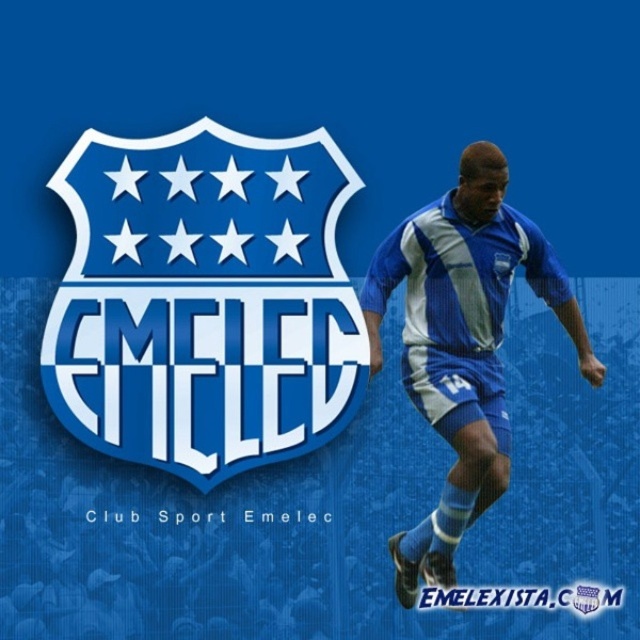
Is point (346, 193) behind point (378, 273)?

Yes, point (346, 193) is behind point (378, 273).

Does blue glossy shield at center appear on the right side of blue fabric soccer player at center?

In fact, blue glossy shield at center is to the left of blue fabric soccer player at center.

Locate an element on the screen. Image resolution: width=640 pixels, height=640 pixels. blue glossy shield at center is located at coordinates (204, 300).